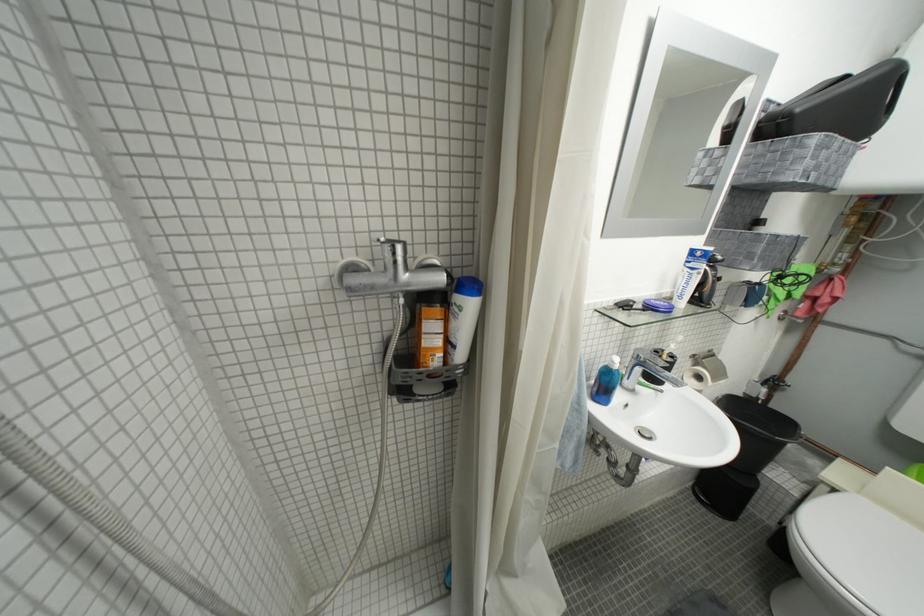
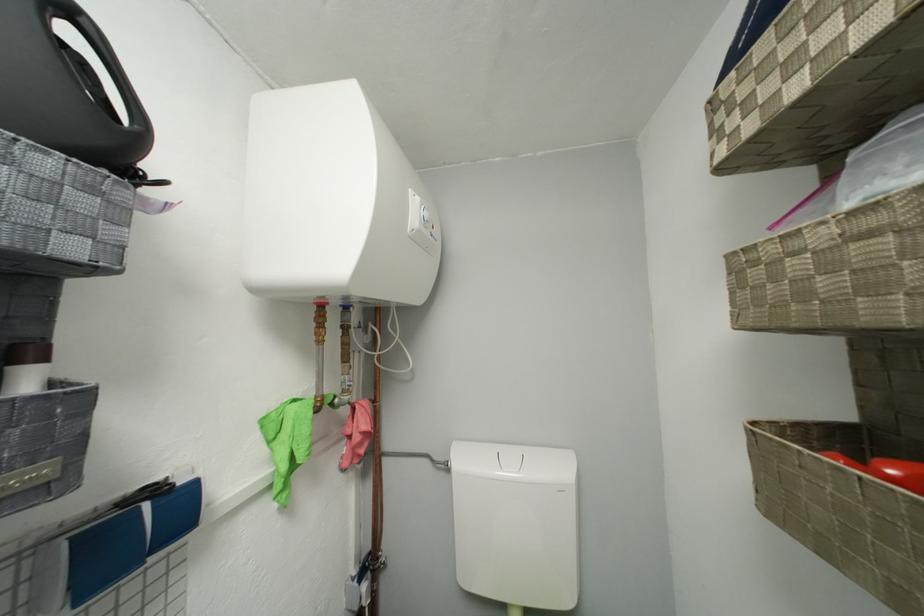
The point at (791, 300) is marked in the first image. Where is the corresponding point in the second image?

(293, 469)